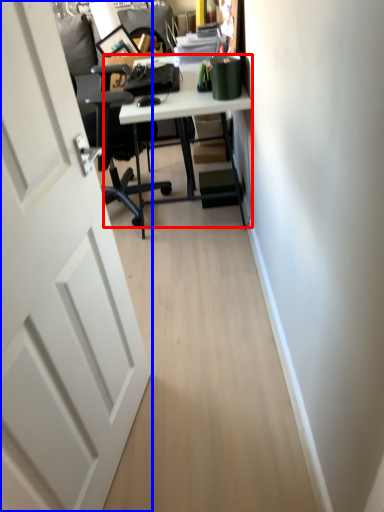
Question: Which point is closer to the camera, desk (highlighted by a red box) or door (highlighted by a blue box)?

Choices:
 (A) desk
 (B) door

Answer: (B)